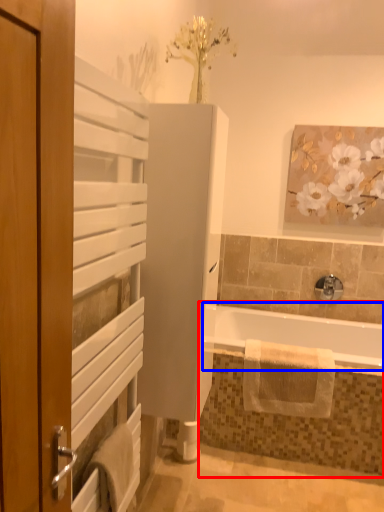
Question: Which object is closer to the camera taking this photo, jacuzzi (highlighted by a red box) or bathtub (highlighted by a blue box)?

Choices:
 (A) jacuzzi
 (B) bathtub

Answer: (B)